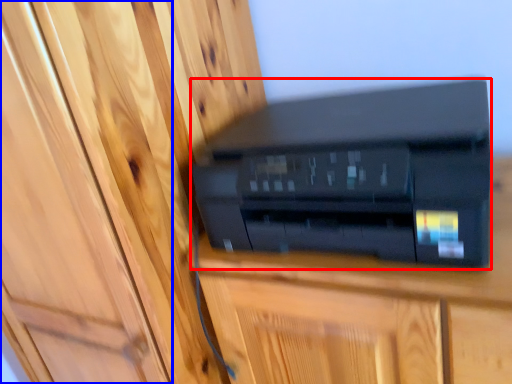
Question: Which of the following is the closest to the observer, printer (highlighted by a red box) or door (highlighted by a blue box)?

Choices:
 (A) printer
 (B) door

Answer: (B)